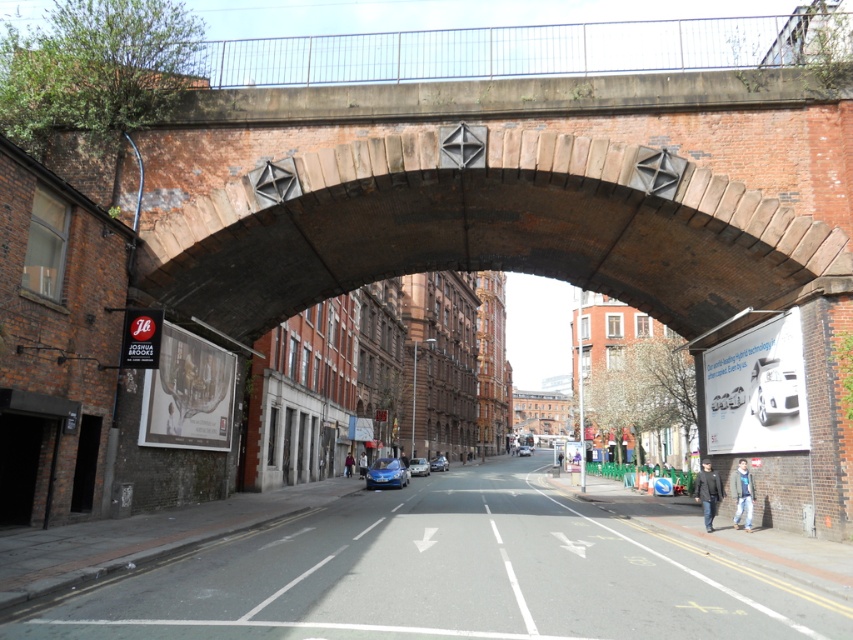
Is shiny blue car at center below shiny blue sedan at center?

No, shiny blue car at center is not below shiny blue sedan at center.

Is shiny blue car at center above shiny blue sedan at center?

Indeed, shiny blue car at center is positioned over shiny blue sedan at center.

Between point (410, 472) and point (519, 454), which one is positioned behind?

The point (519, 454) is more distant.

The height and width of the screenshot is (640, 853). I want to click on shiny blue car at center, so click(418, 467).

Image resolution: width=853 pixels, height=640 pixels. Describe the element at coordinates (387, 474) in the screenshot. I see `metallic blue car at center` at that location.

Does metallic blue car at center appear over blue metallic car at center?

Correct, metallic blue car at center is located above blue metallic car at center.

Locate an element on the screen. Image resolution: width=853 pixels, height=640 pixels. metallic blue car at center is located at coordinates (387, 474).

Which is below, smooth asphalt road at center or shiny blue sedan at center?

Positioned lower is shiny blue sedan at center.

The width and height of the screenshot is (853, 640). Describe the element at coordinates (447, 576) in the screenshot. I see `smooth asphalt road at center` at that location.

Identify the location of smooth asphalt road at center. Image resolution: width=853 pixels, height=640 pixels. (447, 576).